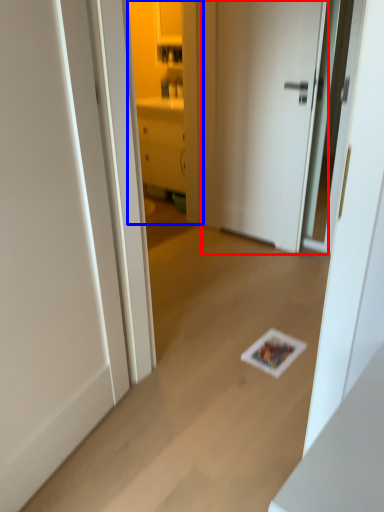
Question: Among these objects, which one is nearest to the camera, door (highlighted by a red box) or cabinetry (highlighted by a blue box)?

Choices:
 (A) door
 (B) cabinetry

Answer: (A)